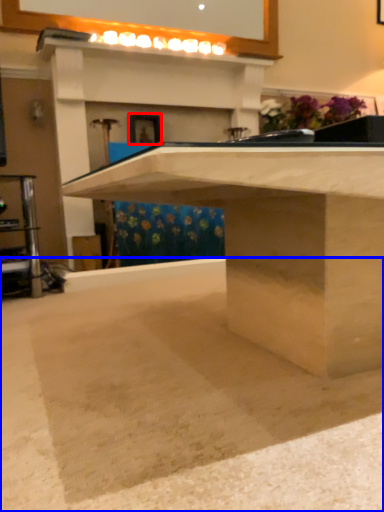
Question: Which point is further to the camera, picture frame (highlighted by a red box) or concrete (highlighted by a blue box)?

Choices:
 (A) picture frame
 (B) concrete

Answer: (A)